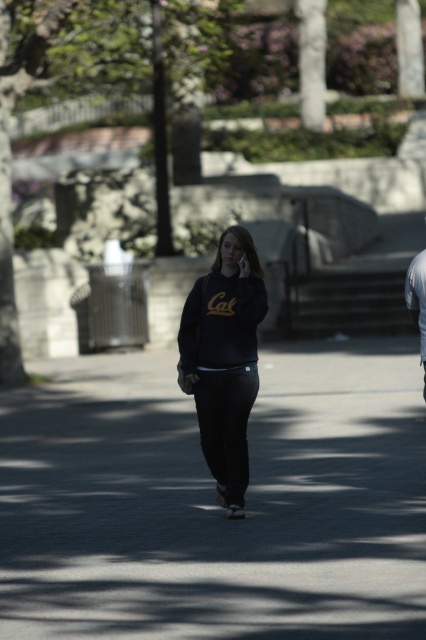
Question: Estimate the real-world distances between objects in this image. Which object is farther from the black matte phone at center?

Choices:
 (A) dark blue fleece sweatshirt at center
 (B) black asphalt at center
 (C) dark gray hoodie at center
 (D) matte black sweatshirt at center

Answer: (B)

Question: Is black asphalt at center to the right of dark gray hoodie at center from the viewer's perspective?

Choices:
 (A) yes
 (B) no

Answer: (B)

Question: Which is nearer to the matte black sweatshirt at center?

Choices:
 (A) dark blue fleece sweatshirt at center
 (B) black asphalt at center

Answer: (A)

Question: Is dark blue fleece sweatshirt at center behind dark gray hoodie at center?

Choices:
 (A) no
 (B) yes

Answer: (A)

Question: Considering the real-world distances, which object is closest to the matte black sweatshirt at center?

Choices:
 (A) dark blue fleece sweatshirt at center
 (B) black matte phone at center
 (C) black asphalt at center
 (D) dark gray hoodie at center

Answer: (A)

Question: Is matte black sweatshirt at center positioned behind black matte phone at center?

Choices:
 (A) yes
 (B) no

Answer: (B)